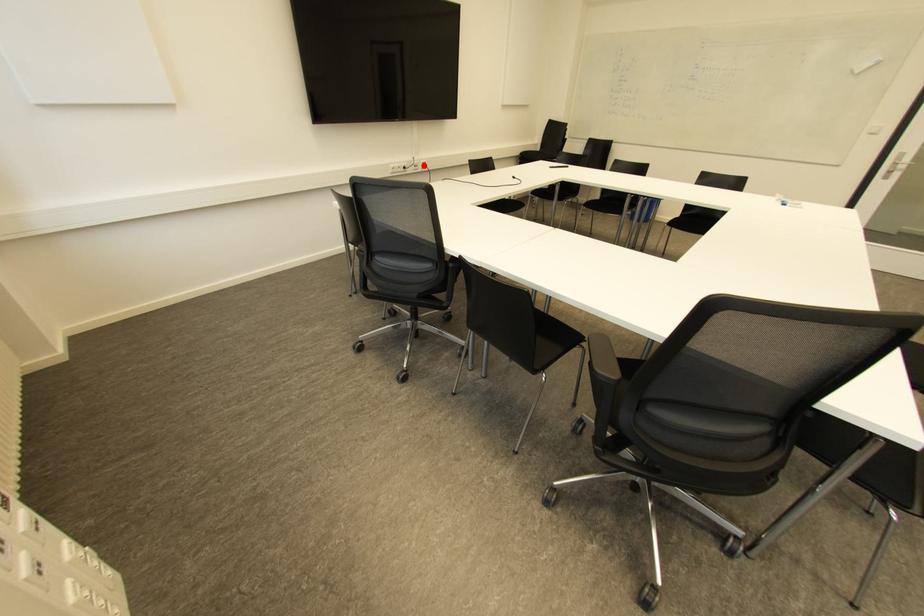
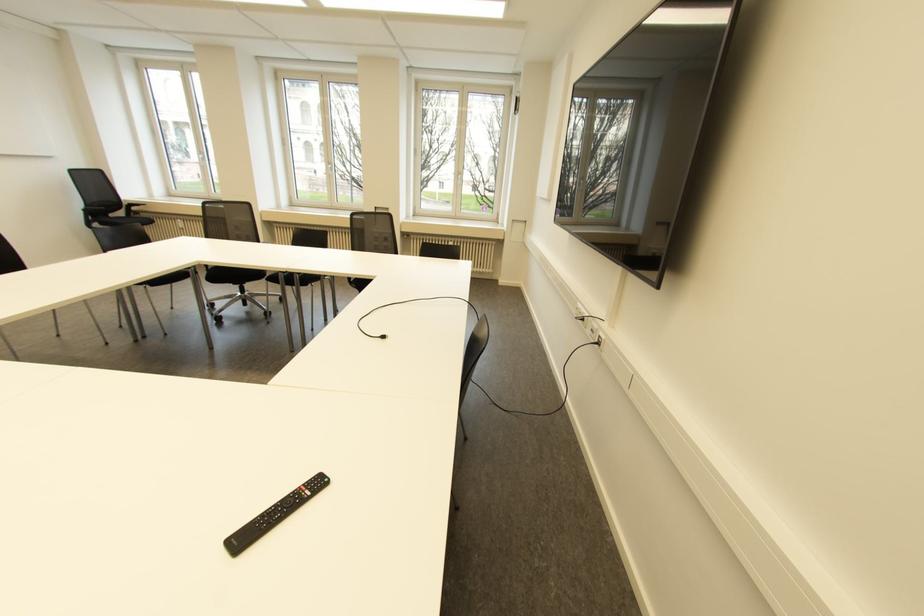
Question: I am providing you with two images of the same scene from different viewpoints. Given a red point in image1, look at the same physical point in image2. Is it:

Choices:
 (A) Closer to the viewpoint
 (B) Farther from the viewpoint

Answer: (A)